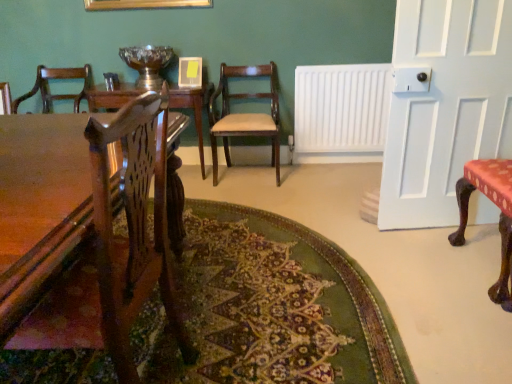
Locate an element on the screen. The image size is (512, 384). mahogany wood chair at center, the first chair when ordered from back to front is located at coordinates (245, 114).

I want to click on wooden table at center, so click(40, 206).

Where is `white painted wood door at right`? This screenshot has height=384, width=512. white painted wood door at right is located at coordinates (444, 105).

The width and height of the screenshot is (512, 384). What do you see at coordinates (444, 105) in the screenshot?
I see `white painted wood door at right` at bounding box center [444, 105].

Measure the distance between white plastic radiator at center and camera.

white plastic radiator at center is 3.23 meters from camera.

Locate an element on the screen. The height and width of the screenshot is (384, 512). white plastic radiator at center is located at coordinates (340, 108).

You are a GUI agent. You are given a task and a screenshot of the screen. Output one action in this format:
    pyautogui.click(x=<x>, y=<y>)
    Task: Click on the mahogany wood chair at center, positioned as the first chair in left-to-right order
    
    Given the screenshot: What is the action you would take?
    pyautogui.click(x=245, y=114)

Consider the image. From a real-world perspective, which object stands above the other?

In real-world perspective, red fabric-covered chair at right, the 2th chair in the left-to-right sequence, is above.

Is red fabric-covered chair at right, the 2th chair in the left-to-right sequence, outside of wooden table at center?

Indeed, red fabric-covered chair at right, the 2th chair in the left-to-right sequence, is completely outside wooden table at center.

Is point (504, 290) closer or farther from the camera than point (201, 91)?

Clearly, point (504, 290) is closer to the camera than point (201, 91).

Can you tell me how much red fabric-covered chair at right, the first chair when ordered from right to left, and wooden table at center differ in facing direction?

They differ by 89.2 degrees in their facing directions.

From the image's perspective, is white plastic radiator at center located beneath red fabric-covered chair at right, the 2th chair in the left-to-right sequence?

No, from the image's perspective, white plastic radiator at center is not beneath red fabric-covered chair at right, the 2th chair in the left-to-right sequence.

Is point (306, 148) more distant than point (482, 191)?

Yes, it is behind point (482, 191).

Would you say white plastic radiator at center is outside red fabric-covered chair at right, which is the 2th chair in back-to-front order?

white plastic radiator at center is positioned outside red fabric-covered chair at right, which is the 2th chair in back-to-front order.

In the scene shown: Is white plastic radiator at center thinner than red fabric-covered chair at right, which is the 2th chair in back-to-front order?

Indeed, white plastic radiator at center has a lesser width compared to red fabric-covered chair at right, which is the 2th chair in back-to-front order.

How different are the orientations of red fabric-covered chair at right, the first chair when ordered from right to left, and white plastic radiator at center in degrees?

red fabric-covered chair at right, the first chair when ordered from right to left, and white plastic radiator at center are facing 89.9 degrees away from each other.

Does point (467, 220) appear closer or farther from the camera than point (364, 94)?

Point (467, 220) is positioned closer to the camera compared to point (364, 94).

Is red fabric-covered chair at right, the first chair when ordered from right to left, positioned behind white plastic radiator at center?

No, red fabric-covered chair at right, the first chair when ordered from right to left, is closer to the viewer.

Is red fabric-covered chair at right, the first chair from the front, facing away from white plastic radiator at center?

No, red fabric-covered chair at right, the first chair from the front,'s orientation is not away from white plastic radiator at center.

From the image's perspective, between wooden table at center and green textured rug at center, who is located below?

green textured rug at center appears lower in the image.

Can you tell me how much wooden table at center and green textured rug at center differ in facing direction?

They differ by 88.5 degrees in their facing directions.

Could you tell me if wooden table at center is turned towards green textured rug at center?

Yes.

Is wooden table at center located outside green textured rug at center?

Yes.

Would you say wooden table at center is inside or outside mahogany wood chair at center, which appears as the 2th chair when viewed from the right?

wooden table at center is outside mahogany wood chair at center, which appears as the 2th chair when viewed from the right.

Which is more to the left, wooden table at center or mahogany wood chair at center, the second chair in the front-to-back sequence?

From the viewer's perspective, wooden table at center appears more on the left side.

From the image's perspective, is wooden table at center located above or below mahogany wood chair at center, the first chair when ordered from back to front?

wooden table at center is below mahogany wood chair at center, the first chair when ordered from back to front.

In the scene shown: Considering the sizes of wooden table at center and mahogany wood chair at center, which appears as the 2th chair when viewed from the right, in the image, is wooden table at center taller or shorter than mahogany wood chair at center, which appears as the 2th chair when viewed from the right,?

In the image, wooden table at center appears to be shorter than mahogany wood chair at center, which appears as the 2th chair when viewed from the right.

Based on the photo, can we say red fabric-covered chair at right, which is the 2th chair in back-to-front order, lies outside wooden table at center?

Indeed, red fabric-covered chair at right, which is the 2th chair in back-to-front order, is completely outside wooden table at center.

Considering the points (483, 183) and (93, 314), which point is in front, point (483, 183) or point (93, 314)?

The point (93, 314) is closer.

Looking at their sizes, would you say red fabric-covered chair at right, the first chair from the front, is wider or thinner than wooden table at center?

red fabric-covered chair at right, the first chair from the front, is thinner than wooden table at center.

Which of these two, red fabric-covered chair at right, which is the 2th chair in back-to-front order, or wooden table at center, stands taller?

red fabric-covered chair at right, which is the 2th chair in back-to-front order, is taller.

Is wooden table at center situated inside white plastic radiator at center or outside?

wooden table at center is outside white plastic radiator at center.

Is wooden table at center far from white plastic radiator at center?

Indeed, wooden table at center is not near white plastic radiator at center.

Who is more distant, wooden table at center or white plastic radiator at center?

white plastic radiator at center is more distant.

How far apart are wooden table at center and white plastic radiator at center?

wooden table at center is 2.21 meters from white plastic radiator at center.

The height and width of the screenshot is (384, 512). What are the coordinates of `table above the red fabric-covered chair at right, the first chair when ordered from right to left (from the image's perspective)` in the screenshot? It's located at (193, 109).

Find the location of `the 2nd chair positioned above the white plastic radiator at center (from a real-world perspective)`. the 2nd chair positioned above the white plastic radiator at center (from a real-world perspective) is located at coordinates (499, 219).

Looking at this image, estimate the real-world distances between objects in this image. Which object is closer to wooden table at center, green textured rug at center or white plastic radiator at center?

white plastic radiator at center is positioned closer to the anchor wooden table at center.

From the image, which object appears to be farther from white plastic radiator at center, white painted wood door at right or wooden table at center?

wooden table at center.

In the scene shown: Looking at the image, which one is located further to wooden table at center, mahogany wood chair at center, the first chair when ordered from back to front, or white painted wood door at right?

The object further to wooden table at center is mahogany wood chair at center, the first chair when ordered from back to front.

Looking at the image, which one is located further to mahogany wood chair at center, the second chair in the front-to-back sequence, white painted wood door at right or white plastic radiator at center?

white painted wood door at right is further to mahogany wood chair at center, the second chair in the front-to-back sequence.

Based on their spatial positions, is wooden table at center or mahogany wood chair at center, the second chair in the front-to-back sequence, closer to red fabric-covered chair at right, the first chair from the front?

mahogany wood chair at center, the second chair in the front-to-back sequence, is positioned closer to the anchor red fabric-covered chair at right, the first chair from the front.

Based on their spatial positions, is wooden table at center or wooden table at center further from green textured rug at center?

The object further to green textured rug at center is wooden table at center.

Consider the image. Which object lies further to the anchor point red fabric-covered chair at right, the first chair when ordered from right to left, white plastic radiator at center or mahogany wood chair at center, which appears as the 2th chair when viewed from the right?

Based on the image, mahogany wood chair at center, which appears as the 2th chair when viewed from the right, appears to be further to red fabric-covered chair at right, the first chair when ordered from right to left.

Considering their positions, is wooden table at center positioned further to green textured rug at center than white painted wood door at right?

wooden table at center lies further to green textured rug at center than the other object.

The width and height of the screenshot is (512, 384). In order to click on mat situated between wooden table at center and white painted wood door at right from left to right in this screenshot , I will do `click(270, 308)`.

This screenshot has height=384, width=512. Find the location of `door situated between wooden table at center and red fabric-covered chair at right, the first chair when ordered from right to left, from left to right`. door situated between wooden table at center and red fabric-covered chair at right, the first chair when ordered from right to left, from left to right is located at coordinates [x=444, y=105].

The image size is (512, 384). I want to click on chair located between red fabric-covered chair at right, the first chair from the front, and white plastic radiator at center in the depth direction, so click(245, 114).

Locate an element on the screen. This screenshot has height=384, width=512. mat between wooden table at center and mahogany wood chair at center, positioned as the first chair in left-to-right order, in the front-back direction is located at coordinates (270, 308).